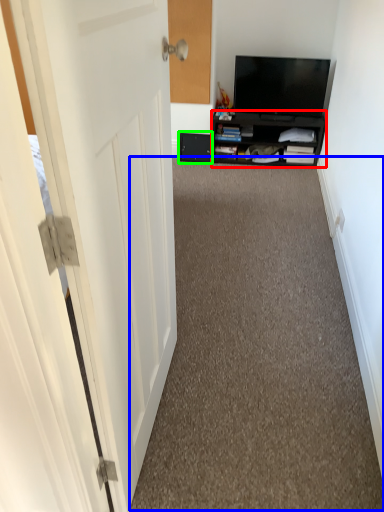
Question: Based on their relative distances, which object is farther from cabinetry (highlighted by a red box)? Choose from corridor (highlighted by a blue box) and drawer (highlighted by a green box).

Choices:
 (A) corridor
 (B) drawer

Answer: (A)